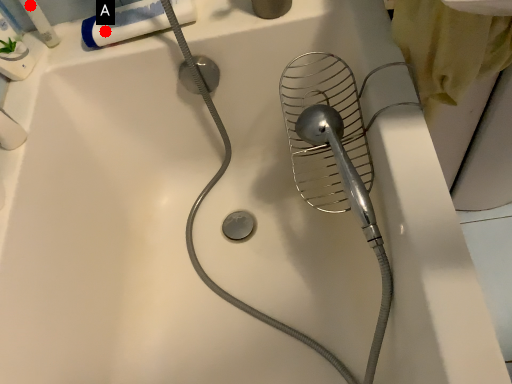
Question: Two points are circled on the image, labeled by A and B beside each circle. Which point is farther to the camera?

Choices:
 (A) A is further
 (B) B is further

Answer: (B)